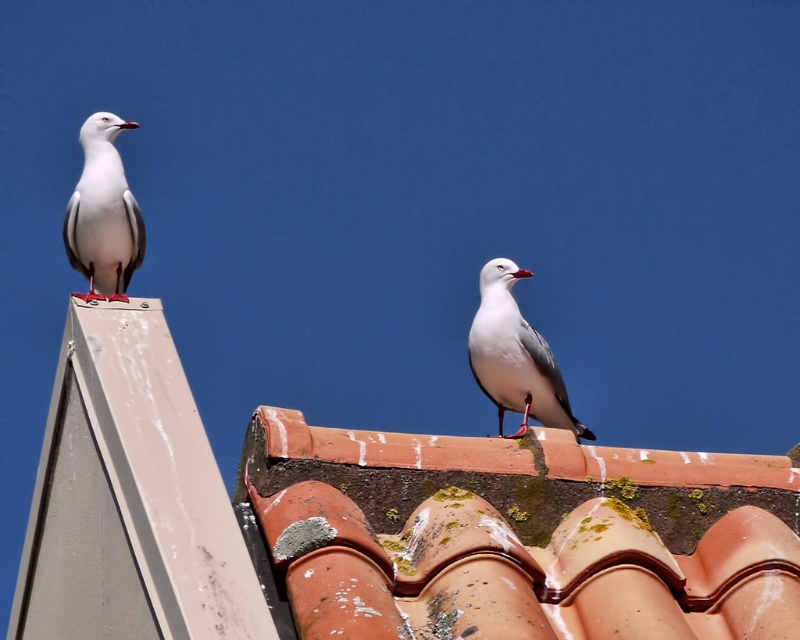
This screenshot has width=800, height=640. Describe the element at coordinates (520, 534) in the screenshot. I see `terracotta tiles at upper center` at that location.

Is point (638, 509) farther from camera compared to point (98, 141)?

No, it is in front of (98, 141).

You are a GUI agent. You are given a task and a screenshot of the screen. Output one action in this format:
    pyautogui.click(x=<x>, y=<y>)
    Task: Click on the terracotta tiles at upper center
    
    Given the screenshot: What is the action you would take?
    pyautogui.click(x=520, y=534)

How far apart are terracotta tiles at upper center and white feathered bird at upper right?

terracotta tiles at upper center is 17.05 meters away from white feathered bird at upper right.

You are a GUI agent. You are given a task and a screenshot of the screen. Output one action in this format:
    pyautogui.click(x=<x>, y=<y>)
    Task: Click on the terracotta tiles at upper center
    
    Given the screenshot: What is the action you would take?
    pyautogui.click(x=520, y=534)

Where is `terracotta tiles at upper center`? This screenshot has width=800, height=640. terracotta tiles at upper center is located at coordinates (520, 534).

Who is higher up, white feathered bird at upper right or white matte bird at upper left?

Positioned higher is white matte bird at upper left.

Between white feathered bird at upper right and white matte bird at upper left, which one has more height?

white matte bird at upper left

Does point (536, 349) lie in front of point (106, 115)?

Yes, point (536, 349) is in front of point (106, 115).

Locate an element on the screen. white feathered bird at upper right is located at coordinates (516, 356).